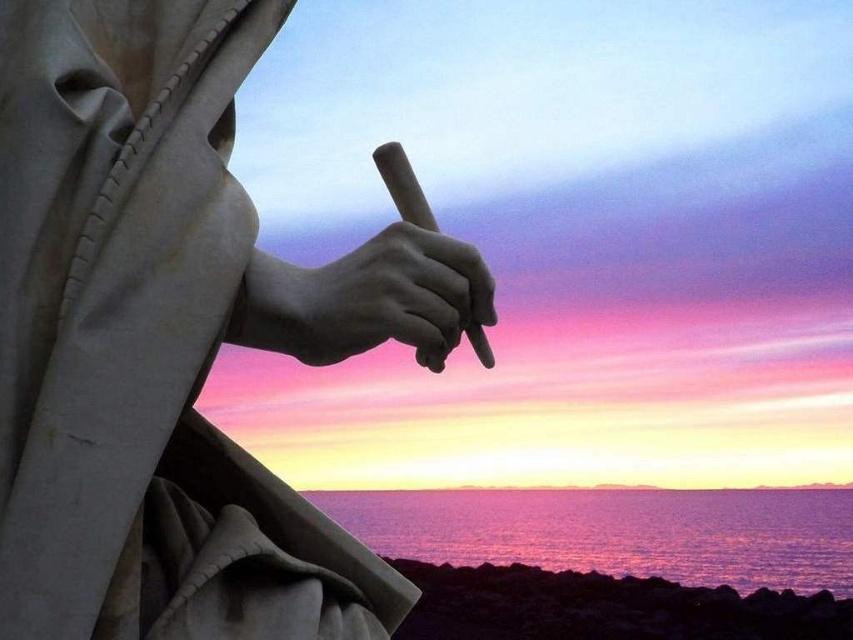
Can you confirm if white marble hand at center is positioned to the right of matte stone hand at center?

Incorrect, white marble hand at center is not on the right side of matte stone hand at center.

From the picture: Can you confirm if white marble hand at center is positioned above matte stone hand at center?

Indeed, white marble hand at center is positioned over matte stone hand at center.

Who is more forward, (x=26, y=116) or (x=469, y=321)?

Point (x=26, y=116) is in front.

Where is `white marble hand at center`? white marble hand at center is located at coordinates (171, 337).

Between purple reflective water at lower center and matte stone hand at center, which one is positioned higher?

Positioned higher is matte stone hand at center.

The height and width of the screenshot is (640, 853). In order to click on purple reflective water at lower center in this screenshot , I will do `click(618, 531)`.

Can you confirm if white marble hand at center is positioned to the right of purple reflective water at lower center?

Indeed, white marble hand at center is positioned on the right side of purple reflective water at lower center.

Who is taller, white marble hand at center or purple reflective water at lower center?

white marble hand at center

What do you see at coordinates (171, 337) in the screenshot? The height and width of the screenshot is (640, 853). I see `white marble hand at center` at bounding box center [171, 337].

This screenshot has height=640, width=853. Identify the location of white marble hand at center. (171, 337).